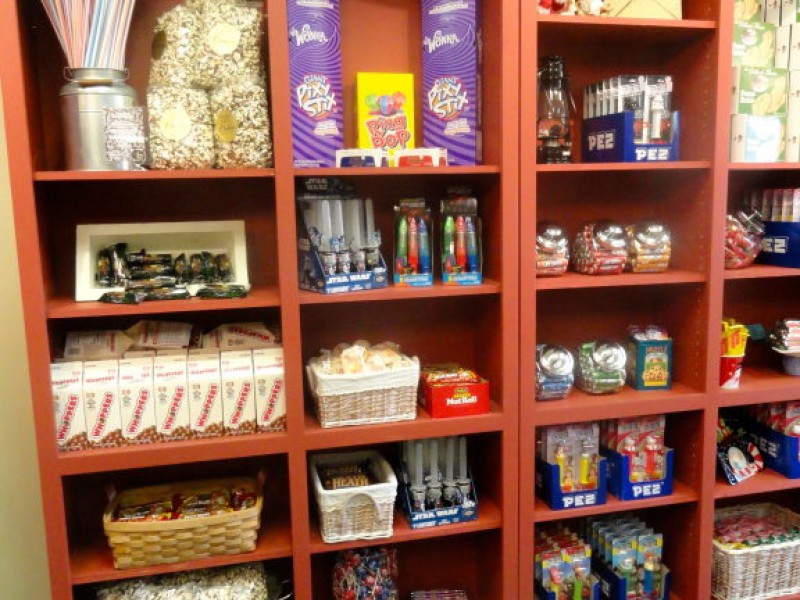
At what (x,y) coordinates should I click in order to perform the action: click on retail candy display. Please return your answer as a coordinate pair (x, y). This screenshot has height=600, width=800. Looking at the image, I should click on (6, 74), (286, 72), (524, 75).